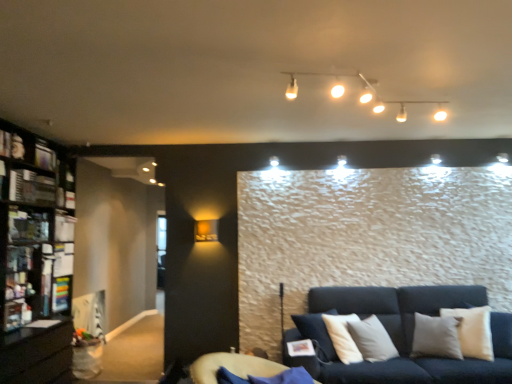
Question: Is white glossy track lights at upper center, which is the 1th lamp in top-to-bottom order, bigger or smaller than metallic silver shelf at left, the first shelf in the top-to-bottom sequence?

Choices:
 (A) small
 (B) big

Answer: (B)

Question: From their relative heights in the image, would you say white glossy track lights at upper center, the second lamp in the left-to-right sequence, is taller or shorter than metallic silver shelf at left, arranged as the 2th shelf when viewed from the back?

Choices:
 (A) short
 (B) tall

Answer: (A)

Question: Which object is the closest to the metallic silver shelf at left, positioned as the second shelf in bottom-to-top order?

Choices:
 (A) black wooden bookcase at left
 (B) matte gold wall sconce at upper left, which ranks as the 1th lamp in left-to-right order
 (C) white glossy track lights at upper center, the second lamp in the left-to-right sequence
 (D) velvet blue futon at lower center
 (E) matte black shelf at left, which is the second shelf from top to bottom

Answer: (A)

Question: Which is nearer to the velvet blue futon at lower center?

Choices:
 (A) black wooden bookcase at left
 (B) white glossy track lights at upper center, marked as the first lamp in a front-to-back arrangement
 (C) matte black shelf at left, placed as the first shelf when sorted from back to front
 (D) metallic silver shelf at left, the first shelf in the top-to-bottom sequence
 (E) matte gold wall sconce at upper left, which is counted as the first lamp, starting from the bottom

Answer: (E)